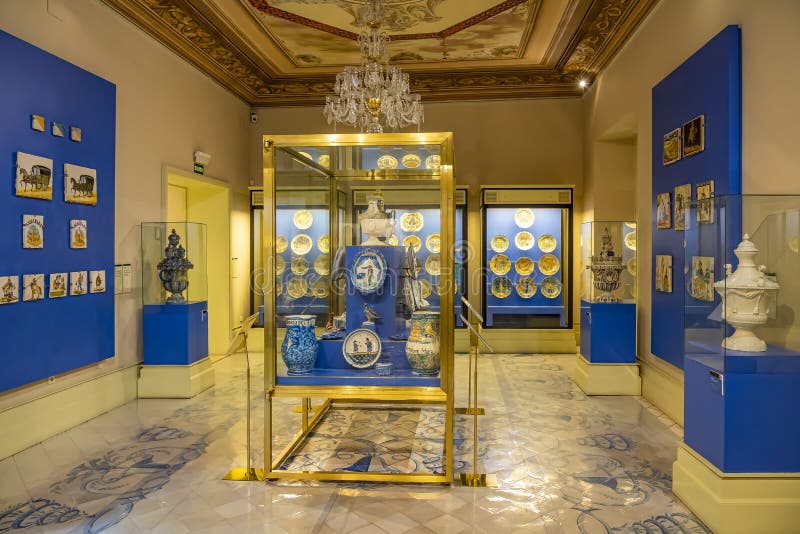
Where is `ceiling`? This screenshot has height=534, width=800. ceiling is located at coordinates (296, 20).